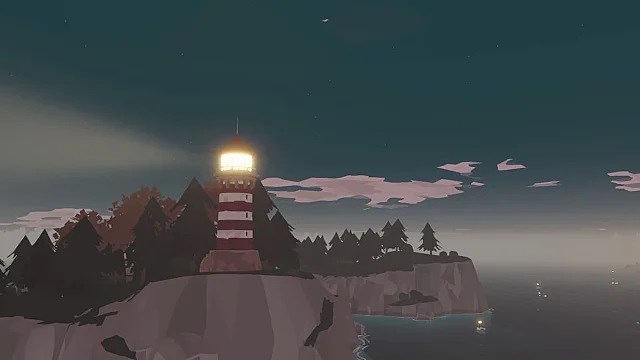
Locate an element on the screen. lamp is located at coordinates pyautogui.click(x=242, y=160).